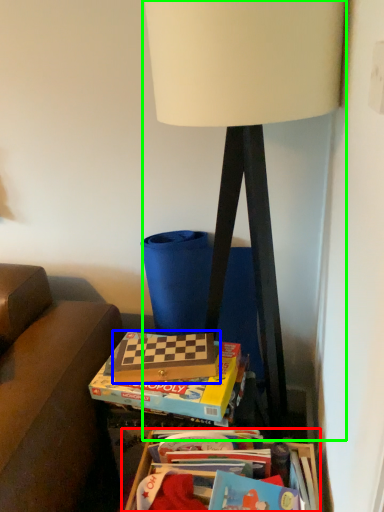
Question: Which is nearer to the table (highlighted by a red box)? paperback book (highlighted by a blue box) or lamp (highlighted by a green box).

Choices:
 (A) paperback book
 (B) lamp

Answer: (A)